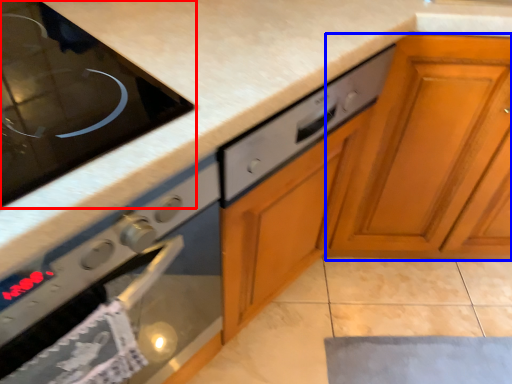
Question: Which object appears closest to the camera in this image, home appliance (highlighted by a red box) or cabinetry (highlighted by a blue box)?

Choices:
 (A) home appliance
 (B) cabinetry

Answer: (A)